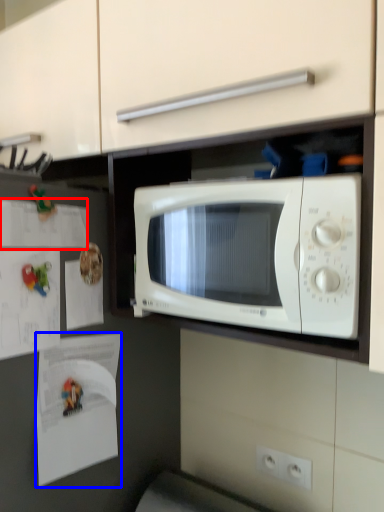
Question: Which object appears closest to the camera in this image, paper (highlighted by a red box) or paper (highlighted by a blue box)?

Choices:
 (A) paper
 (B) paper

Answer: (A)